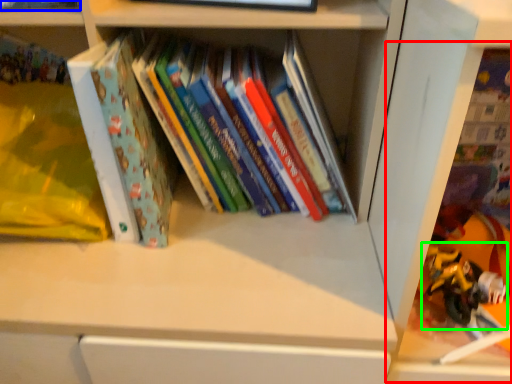
Question: Considering the real-world distances, which object is farthest from shelf (highlighted by a red box)? book (highlighted by a blue box) or toy (highlighted by a green box)?

Choices:
 (A) book
 (B) toy

Answer: (A)